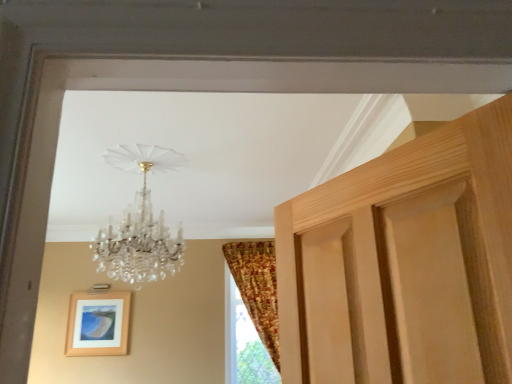
The height and width of the screenshot is (384, 512). What do you see at coordinates (98, 324) in the screenshot? I see `wooden picture frame at lower left` at bounding box center [98, 324].

The height and width of the screenshot is (384, 512). In order to click on wooden picture frame at lower left in this screenshot , I will do 98,324.

Is crystal glass chandelier at upper center oriented away from patterned fabric curtain at right?

Yes.

Which object is more forward, crystal glass chandelier at upper center or patterned fabric curtain at right?

crystal glass chandelier at upper center.

In the image, is crystal glass chandelier at upper center on the left side or the right side of patterned fabric curtain at right?

crystal glass chandelier at upper center is positioned on patterned fabric curtain at right's left side.

Based on the photo, looking at their sizes, would you say wooden picture frame at lower left is wider or thinner than crystal glass chandelier at upper center?

Considering their sizes, wooden picture frame at lower left looks slimmer than crystal glass chandelier at upper center.

Does wooden picture frame at lower left have a lesser height compared to crystal glass chandelier at upper center?

Yes, wooden picture frame at lower left is shorter than crystal glass chandelier at upper center.

Which of these two, wooden picture frame at lower left or crystal glass chandelier at upper center, is bigger?

crystal glass chandelier at upper center.

Does crystal glass chandelier at upper center come behind wooden picture frame at lower left?

No, crystal glass chandelier at upper center is closer to the camera.

Is crystal glass chandelier at upper center shorter than wooden picture frame at lower left?

In fact, crystal glass chandelier at upper center may be taller than wooden picture frame at lower left.

Looking at this image, based on their sizes in the image, would you say crystal glass chandelier at upper center is bigger or smaller than wooden picture frame at lower left?

In the image, crystal glass chandelier at upper center appears to be larger than wooden picture frame at lower left.

Does point (141, 229) appear closer or farther from the camera than point (117, 345)?

Point (141, 229) is closer to the camera than point (117, 345).

Which object is further away from the camera taking this photo, patterned fabric curtain at right or crystal glass chandelier at upper center?

patterned fabric curtain at right is further away from the camera.

Is patterned fabric curtain at right surrounding crystal glass chandelier at upper center?

No, crystal glass chandelier at upper center is located outside of patterned fabric curtain at right.

Is patterned fabric curtain at right at the left side of crystal glass chandelier at upper center?

Incorrect, patterned fabric curtain at right is not on the left side of crystal glass chandelier at upper center.

From the image's perspective, is patterned fabric curtain at right above or below crystal glass chandelier at upper center?

From the image's perspective, patterned fabric curtain at right appears below crystal glass chandelier at upper center.

Could you tell me if wooden picture frame at lower left is facing patterned fabric curtain at right?

No, wooden picture frame at lower left is not facing towards patterned fabric curtain at right.

Would you say wooden picture frame at lower left is to the left or to the right of patterned fabric curtain at right in the picture?

wooden picture frame at lower left is to the left of patterned fabric curtain at right.

How distant is wooden picture frame at lower left from patterned fabric curtain at right?

wooden picture frame at lower left and patterned fabric curtain at right are 5.30 feet apart.

Which is nearer, (125, 316) or (270, 347)?

→ The point (270, 347) is closer to the camera.

Does patterned fabric curtain at right have a lesser width compared to wooden picture frame at lower left?

No, patterned fabric curtain at right is not thinner than wooden picture frame at lower left.

From the image's perspective, who appears lower, patterned fabric curtain at right or wooden picture frame at lower left?

wooden picture frame at lower left, from the image's perspective.

Is wooden picture frame at lower left completely or partially inside patterned fabric curtain at right?

No, wooden picture frame at lower left is not inside patterned fabric curtain at right.

How different are the orientations of patterned fabric curtain at right and wooden picture frame at lower left in degrees?

patterned fabric curtain at right and wooden picture frame at lower left are facing 0.23 degrees away from each other.

Locate an element on the screen. curtain lying behind the crystal glass chandelier at upper center is located at coordinates (257, 288).

You are a GUI agent. You are given a task and a screenshot of the screen. Output one action in this format:
    pyautogui.click(x=<x>, y=<y>)
    Task: Click on the lamp that appears on the right of wooden picture frame at lower left
    The height and width of the screenshot is (384, 512).
    Given the screenshot: What is the action you would take?
    pyautogui.click(x=140, y=223)

Which object lies further to the anchor point patterned fabric curtain at right, wooden picture frame at lower left or crystal glass chandelier at upper center?

crystal glass chandelier at upper center lies further to patterned fabric curtain at right than the other object.

Looking at the image, which one is located further to crystal glass chandelier at upper center, wooden picture frame at lower left or patterned fabric curtain at right?

wooden picture frame at lower left is further to crystal glass chandelier at upper center.

Considering their positions, is crystal glass chandelier at upper center positioned closer to patterned fabric curtain at right than wooden picture frame at lower left?

Based on the image, wooden picture frame at lower left appears to be nearer to patterned fabric curtain at right.

Which object lies further to the anchor point wooden picture frame at lower left, patterned fabric curtain at right or crystal glass chandelier at upper center?

crystal glass chandelier at upper center is positioned further to the anchor wooden picture frame at lower left.

Consider the image. Estimate the real-world distances between objects in this image. Which object is closer to wooden picture frame at lower left, crystal glass chandelier at upper center or patterned fabric curtain at right?

patterned fabric curtain at right lies closer to wooden picture frame at lower left than the other object.

Which object lies nearer to the anchor point crystal glass chandelier at upper center, patterned fabric curtain at right or wooden picture frame at lower left?

Among the two, patterned fabric curtain at right is located nearer to crystal glass chandelier at upper center.

At what (x,y) coordinates should I click in order to perform the action: click on curtain between crystal glass chandelier at upper center and wooden picture frame at lower left from front to back. Please return your answer as a coordinate pair (x, y). This screenshot has width=512, height=384. Looking at the image, I should click on click(257, 288).